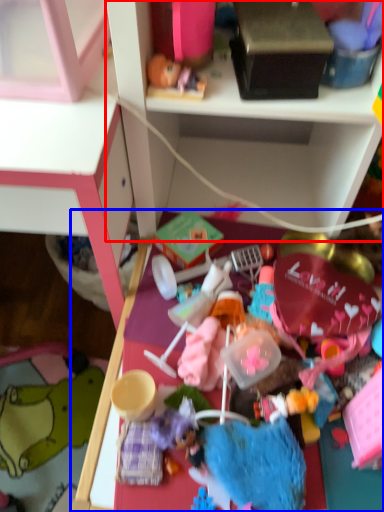
Question: Which point is further to the camera, shelf (highlighted by a red box) or table (highlighted by a blue box)?

Choices:
 (A) shelf
 (B) table

Answer: (B)